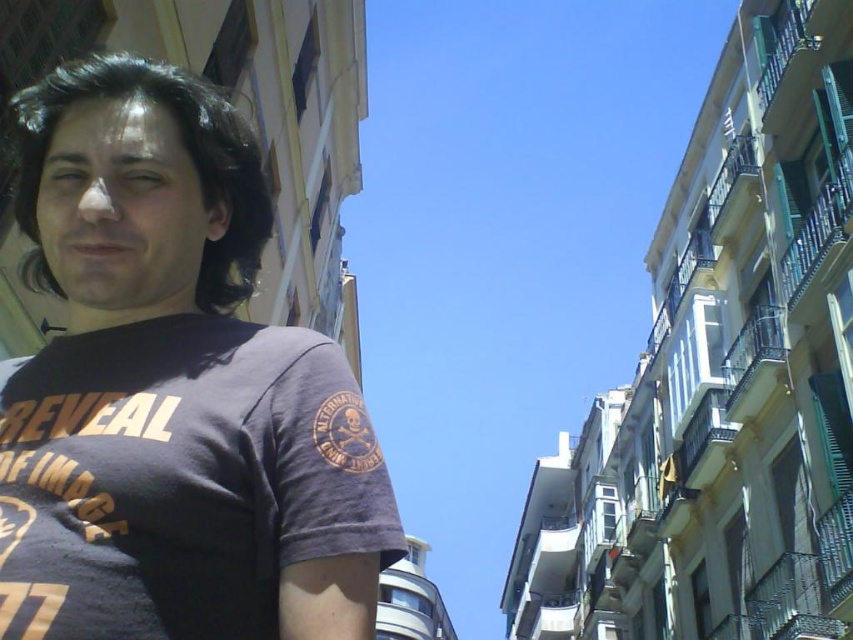
Is dark purple t-shirt at center smaller than dark brown hair at center?

Incorrect, dark purple t-shirt at center is not smaller in size than dark brown hair at center.

Measure the distance from dark purple t-shirt at center to dark brown hair at center.

dark purple t-shirt at center and dark brown hair at center are 2.45 meters apart from each other.

What do you see at coordinates (173, 388) in the screenshot? I see `dark purple t-shirt at center` at bounding box center [173, 388].

Locate an element on the screen. The width and height of the screenshot is (853, 640). dark purple t-shirt at center is located at coordinates pos(173,388).